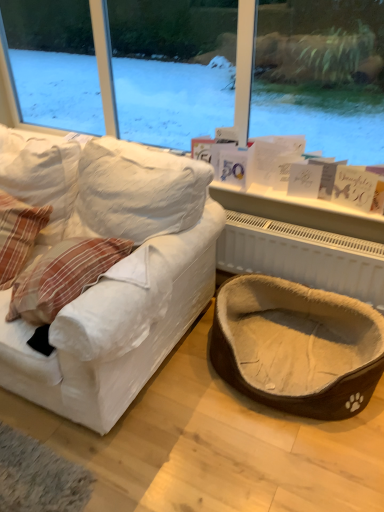
Identify the location of vacant space positioned to the left of brown fuzzy pet bed at lower right. The width and height of the screenshot is (384, 512). (164, 410).